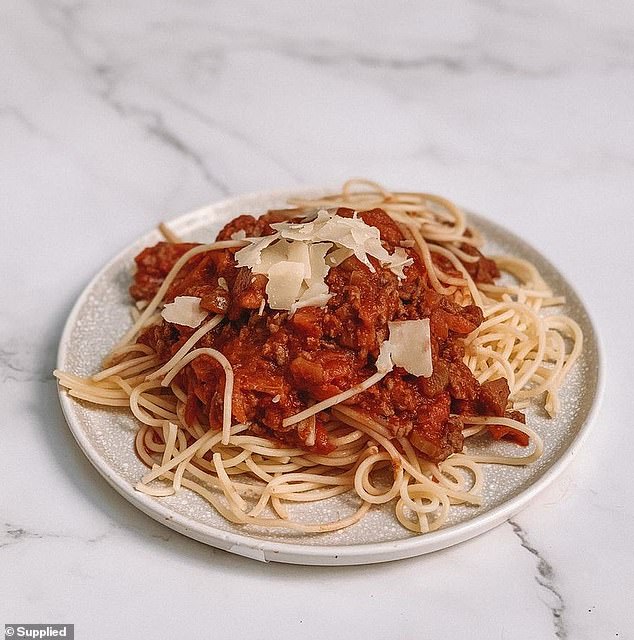
Identify the location of white and black marble surface. This screenshot has width=634, height=640. (276, 136), (153, 128).